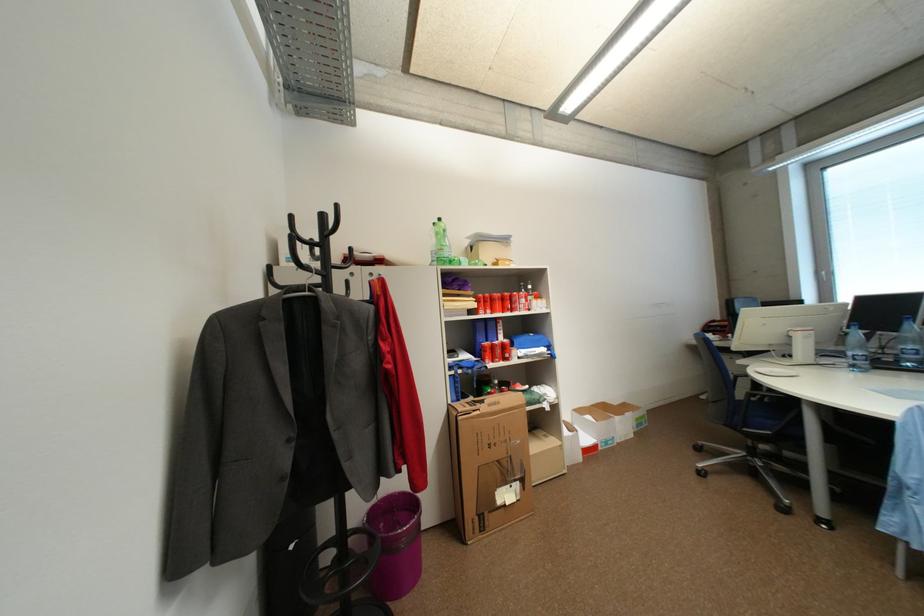
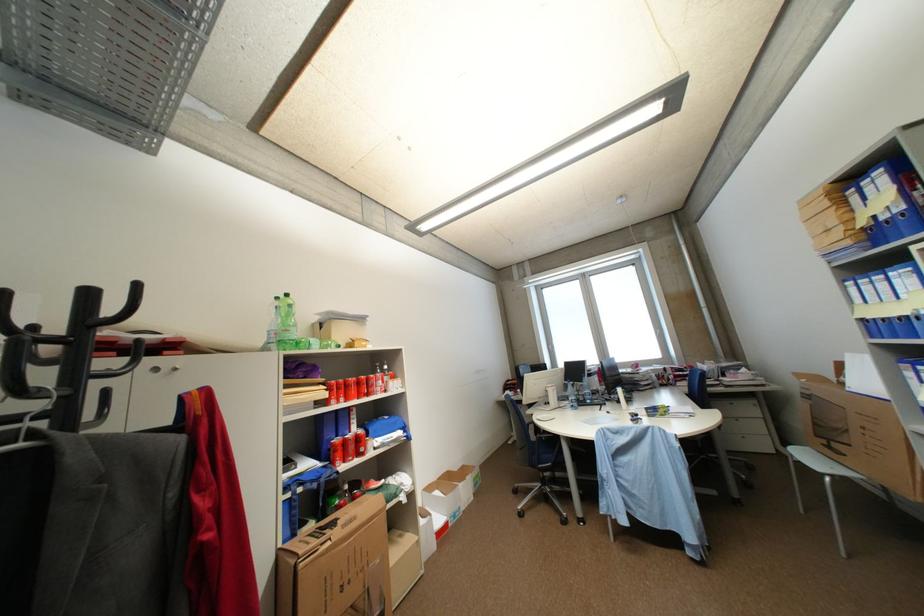
The point at (588, 411) is marked in the first image. Where is the corresponding point in the second image?

(438, 490)